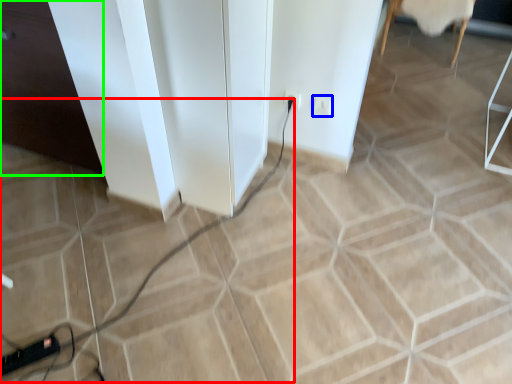
Question: Estimate the real-world distances between objects in this image. Which object is farther from cable (highlighted by a red box), socket (highlighted by a blue box) or file cabinet (highlighted by a green box)?

Choices:
 (A) socket
 (B) file cabinet

Answer: (B)